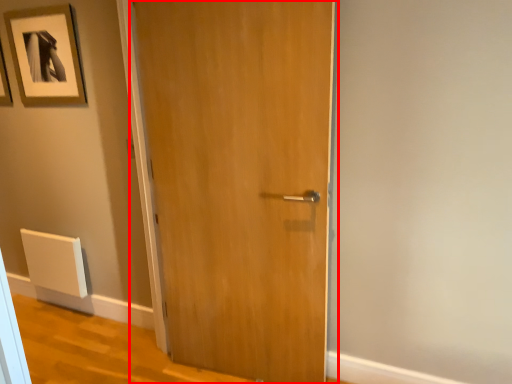
Question: From the image, what is the correct spatial relationship of door (annotated by the red box) in relation to picture frame?

Choices:
 (A) left
 (B) right

Answer: (B)